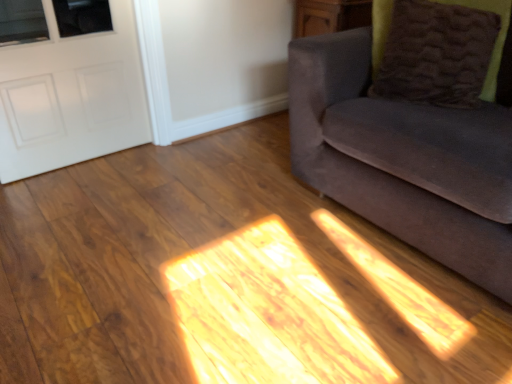
What do you see at coordinates (404, 159) in the screenshot? I see `velvet gray couch at right` at bounding box center [404, 159].

The height and width of the screenshot is (384, 512). In order to click on white matte door at left in this screenshot , I will do `click(71, 97)`.

Is point (33, 103) farther from camera compared to point (378, 46)?

Yes, point (33, 103) is farther from viewer.

The image size is (512, 384). What are the coordinates of `door below the brown fuzzy pillow at upper right (from the image's perspective)` in the screenshot? It's located at (71, 97).

Looking at this image, is white matte door at left with brown fuzzy pillow at upper right?

No, white matte door at left is not with brown fuzzy pillow at upper right.

From a real-world perspective, who is located lower, velvet gray couch at right or brown fuzzy pillow at upper right?

velvet gray couch at right is physically lower.

Which is more to the left, velvet gray couch at right or brown fuzzy pillow at upper right?

brown fuzzy pillow at upper right.

Relative to brown fuzzy pillow at upper right, is velvet gray couch at right in front or behind?

In the image, velvet gray couch at right appears in front of brown fuzzy pillow at upper right.

Between velvet gray couch at right and brown fuzzy pillow at upper right, which one has larger size?

velvet gray couch at right.

Who is taller, brown fuzzy pillow at upper right or white matte door at left?

With more height is white matte door at left.

This screenshot has height=384, width=512. I want to click on pillow above the white matte door at left (from a real-world perspective), so click(438, 48).

Is brown fuzzy pillow at upper right not near white matte door at left?

Absolutely, brown fuzzy pillow at upper right is distant from white matte door at left.

Considering the relative sizes of brown fuzzy pillow at upper right and white matte door at left in the image provided, is brown fuzzy pillow at upper right thinner than white matte door at left?

No, brown fuzzy pillow at upper right is not thinner than white matte door at left.

How many degrees apart are the facing directions of white matte door at left and velvet gray couch at right?

There is a 90.4-degree angle between the facing directions of white matte door at left and velvet gray couch at right.

In the image, there is a velvet gray couch at right. At what (x,y) coordinates should I click in order to perform the action: click on door below it (from a real-world perspective). Please return your answer as a coordinate pair (x, y). The width and height of the screenshot is (512, 384). Looking at the image, I should click on (71, 97).

Could you tell me if white matte door at left is facing velvet gray couch at right?

No, white matte door at left is not oriented towards velvet gray couch at right.

Consider the image. Is white matte door at left far from velvet gray couch at right?

white matte door at left is positioned a significant distance from velvet gray couch at right.

Is brown fuzzy pillow at upper right oriented away from velvet gray couch at right?

Yes, brown fuzzy pillow at upper right's orientation is away from velvet gray couch at right.

Who is taller, brown fuzzy pillow at upper right or velvet gray couch at right?

velvet gray couch at right.

In the scene shown: Who is smaller, brown fuzzy pillow at upper right or velvet gray couch at right?

With smaller size is brown fuzzy pillow at upper right.

Is velvet gray couch at right taller than white matte door at left?

Yes, velvet gray couch at right is taller than white matte door at left.

Is velvet gray couch at right next to white matte door at left and touching it?

No.

Is velvet gray couch at right located outside white matte door at left?

Yes, velvet gray couch at right is outside of white matte door at left.

From the image's perspective, which is above, velvet gray couch at right or white matte door at left?

white matte door at left.

You are a GUI agent. You are given a task and a screenshot of the screen. Output one action in this format:
    pyautogui.click(x=<x>, y=<y>)
    Task: Click on the pillow located above the white matte door at left (from the image's perspective)
    The height and width of the screenshot is (384, 512).
    Given the screenshot: What is the action you would take?
    pyautogui.click(x=438, y=48)

In order to click on pillow behind the velvet gray couch at right in this screenshot , I will do `click(438, 48)`.

When comparing their distances from white matte door at left, does brown fuzzy pillow at upper right or velvet gray couch at right seem closer?

Based on the image, velvet gray couch at right appears to be nearer to white matte door at left.

Considering their positions, is white matte door at left positioned closer to brown fuzzy pillow at upper right than velvet gray couch at right?

velvet gray couch at right.

Which object lies nearer to the anchor point brown fuzzy pillow at upper right, velvet gray couch at right or white matte door at left?

velvet gray couch at right is closer to brown fuzzy pillow at upper right.

When comparing their distances from white matte door at left, does velvet gray couch at right or brown fuzzy pillow at upper right seem further?

brown fuzzy pillow at upper right is further to white matte door at left.

Considering their positions, is brown fuzzy pillow at upper right positioned further to velvet gray couch at right than white matte door at left?

The object further to velvet gray couch at right is white matte door at left.

Which object lies nearer to the anchor point velvet gray couch at right, white matte door at left or brown fuzzy pillow at upper right?

Among the two, brown fuzzy pillow at upper right is located nearer to velvet gray couch at right.

I want to click on pillow between white matte door at left and velvet gray couch at right from left to right, so point(438,48).